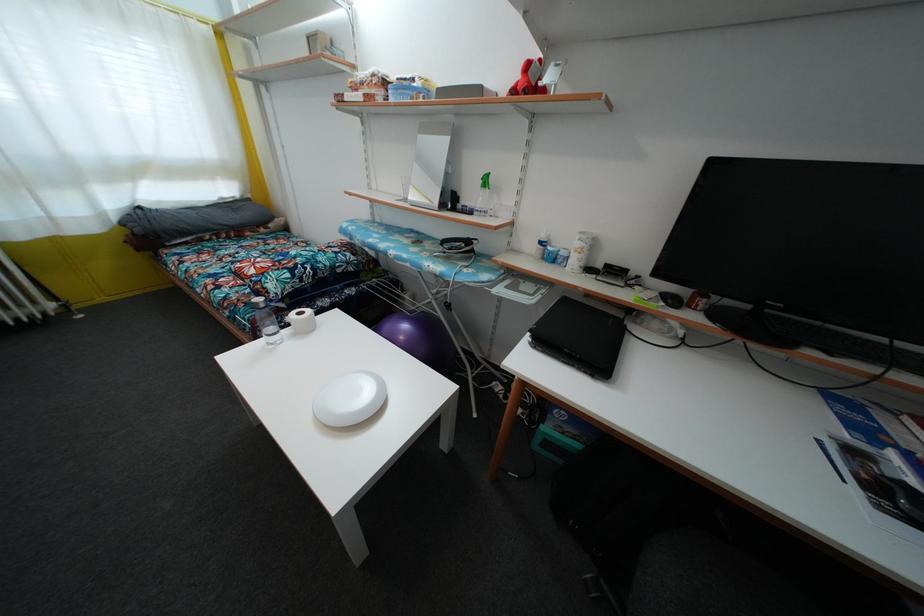
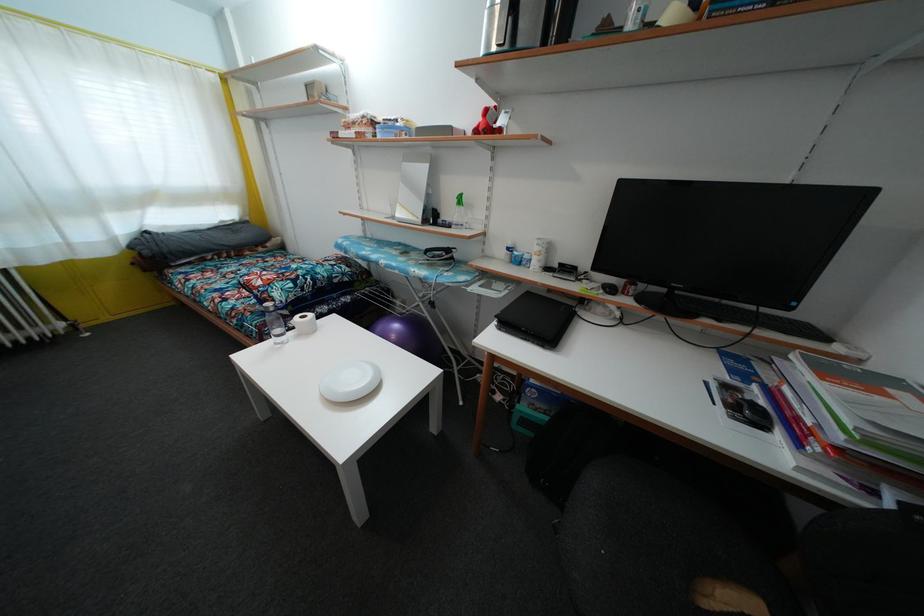
Locate, in the second image, the point that corresponds to pixel 531 74 in the first image.

(490, 119)